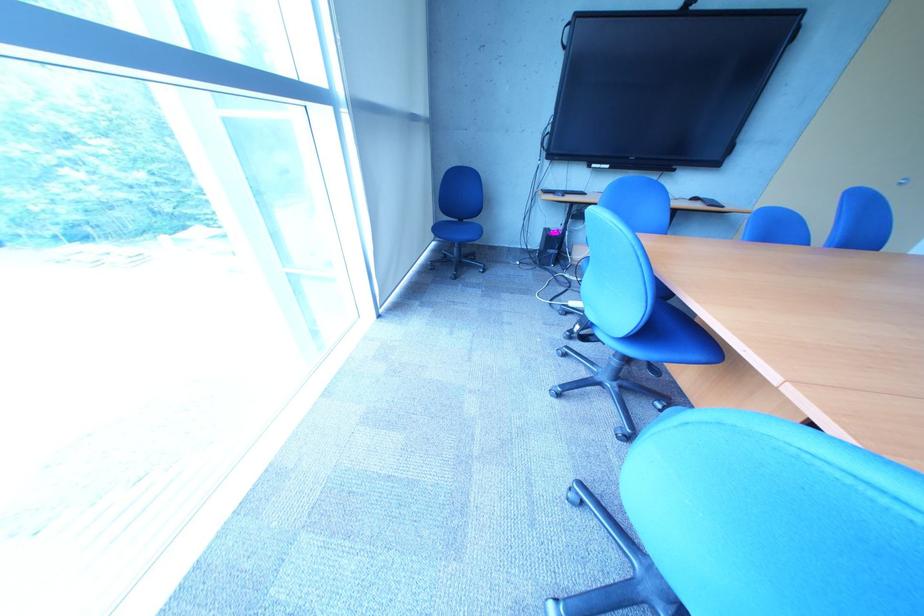
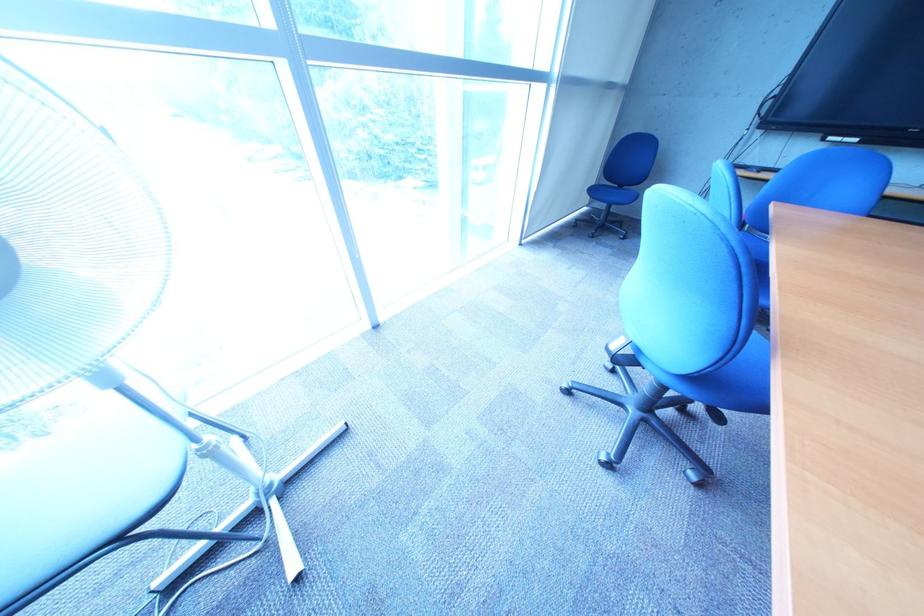
Question: The camera is either moving clockwise (left) or counter-clockwise (right) around the object. The first image is from the beginning of the video and the second image is from the end. Is the camera moving left or right when shooting the video?

Choices:
 (A) Left
 (B) Right

Answer: (B)